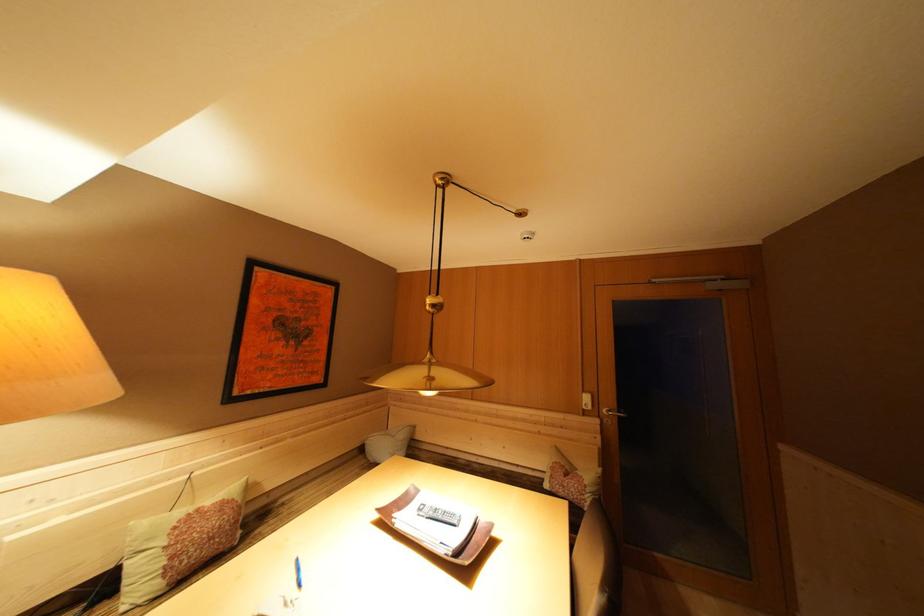
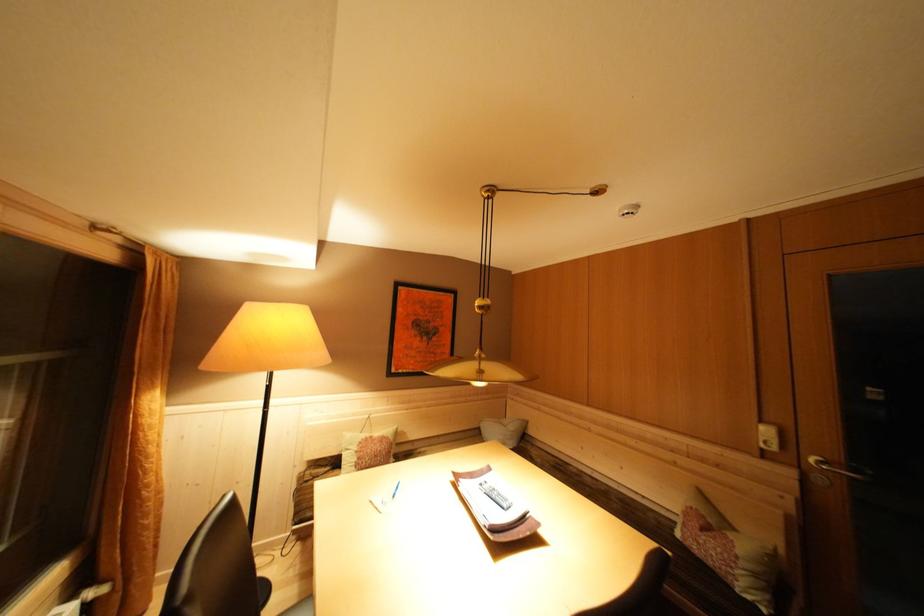
In the second image, find the point that corresponds to [592,487] in the first image.

(746, 557)